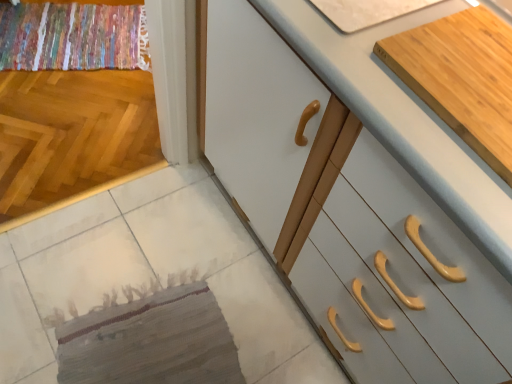
Question: Should I look upward or downward to see textured beige mat at lower left?

Choices:
 (A) up
 (B) down

Answer: (B)

Question: Considering the relative sizes of textured beige mat at lower left and light wood cutting board at upper right, which is the second cabinetry from front to back, in the image provided, is textured beige mat at lower left wider than light wood cutting board at upper right, which is the second cabinetry from front to back,?

Choices:
 (A) yes
 (B) no

Answer: (B)

Question: Are textured beige mat at lower left and light wood cutting board at upper right, which is the second cabinetry from front to back, located far from each other?

Choices:
 (A) no
 (B) yes

Answer: (A)

Question: Is textured beige mat at lower left not within light wood cutting board at upper right, which ranks as the first cabinetry in back-to-front order?

Choices:
 (A) yes
 (B) no

Answer: (A)

Question: Is the position of textured beige mat at lower left less distant than that of light wood cutting board at upper right, which ranks as the first cabinetry in back-to-front order?

Choices:
 (A) no
 (B) yes

Answer: (A)

Question: Can you confirm if textured beige mat at lower left is bigger than light wood cutting board at upper right, which is the second cabinetry from front to back?

Choices:
 (A) yes
 (B) no

Answer: (B)

Question: Is light wood cutting board at upper right, which is the second cabinetry from front to back, a part of textured beige mat at lower left?

Choices:
 (A) yes
 (B) no

Answer: (B)

Question: Is light wood cutting board at upper right, which is the second cabinetry from front to back, at the right side of multicolored woven rug at upper left?

Choices:
 (A) no
 (B) yes

Answer: (B)

Question: Is light wood cutting board at upper right, which ranks as the first cabinetry in back-to-front order, oriented away from multicolored woven rug at upper left?

Choices:
 (A) yes
 (B) no

Answer: (B)

Question: Can you confirm if light wood cutting board at upper right, which ranks as the first cabinetry in back-to-front order, is smaller than multicolored woven rug at upper left?

Choices:
 (A) no
 (B) yes

Answer: (B)

Question: Is light wood cutting board at upper right, which is the second cabinetry from front to back, completely or partially outside of multicolored woven rug at upper left?

Choices:
 (A) no
 (B) yes

Answer: (B)

Question: Can you confirm if light wood cutting board at upper right, which ranks as the first cabinetry in back-to-front order, is thinner than multicolored woven rug at upper left?

Choices:
 (A) yes
 (B) no

Answer: (A)

Question: Is the depth of light wood cutting board at upper right, which is the second cabinetry from front to back, greater than that of multicolored woven rug at upper left?

Choices:
 (A) no
 (B) yes

Answer: (A)

Question: Is white glossy cabinet at center, the 1th cabinetry positioned from the front, shorter than textured beige mat at lower left?

Choices:
 (A) yes
 (B) no

Answer: (B)